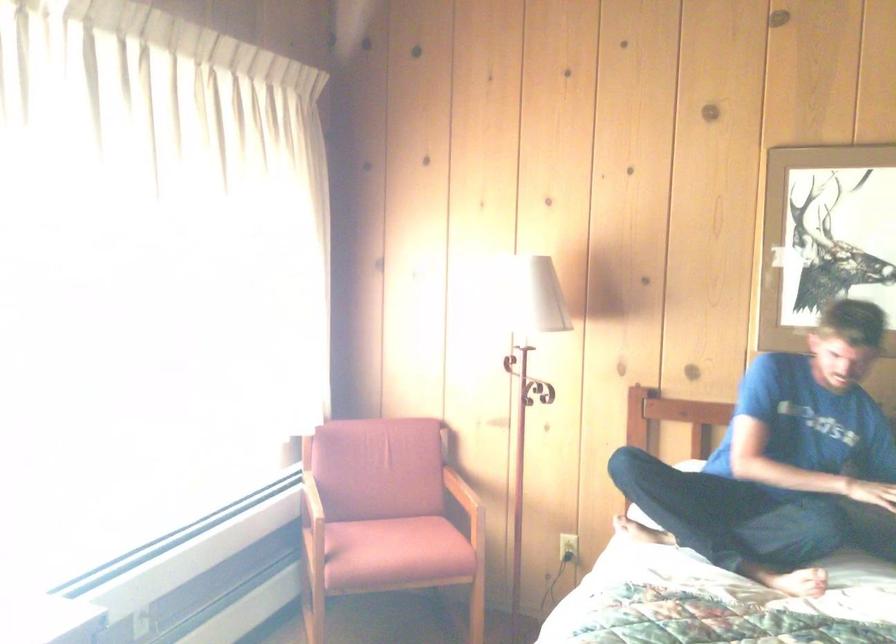
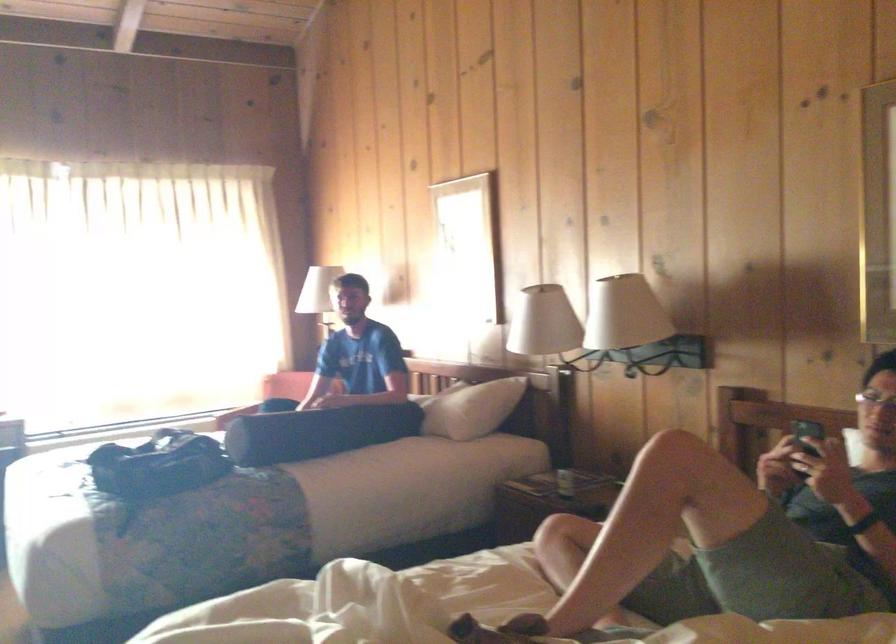
Question: The images are taken continuously from a first-person perspective. In which direction are you moving?

Choices:
 (A) Left
 (B) Right
 (C) Forward
 (D) Backward

Answer: (B)